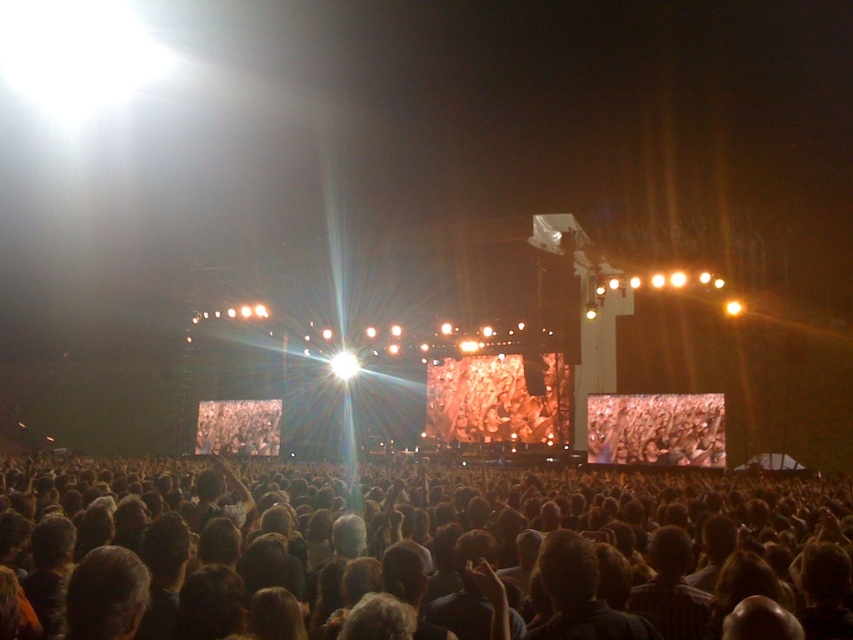
Question: Which object is farther from the camera taking this photo?

Choices:
 (A) matte black crowd at center
 (B) dark brown hair at center

Answer: (A)

Question: Where is dark brown hair at center located in relation to matte black crowd at center in the image?

Choices:
 (A) right
 (B) left

Answer: (B)

Question: Which of the following is the farthest from the observer?

Choices:
 (A) (698, 397)
 (B) (833, 624)

Answer: (A)

Question: Which point is farther to the camera?

Choices:
 (A) tap(152, 604)
 (B) tap(671, 419)

Answer: (B)

Question: Is dark brown hair at center in front of matte black crowd at center?

Choices:
 (A) no
 (B) yes

Answer: (B)

Question: Can you confirm if dark brown hair at center is smaller than matte black crowd at center?

Choices:
 (A) yes
 (B) no

Answer: (B)